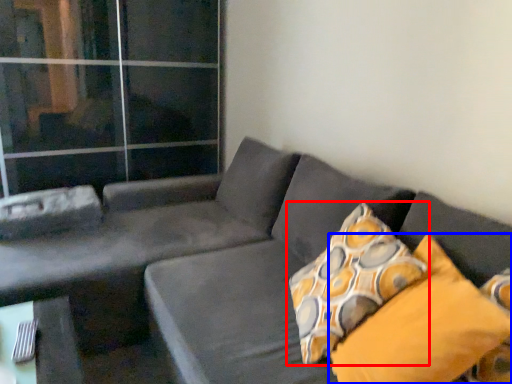
Question: Which of the following is the farthest to the observer, pillow (highlighted by a red box) or pillow (highlighted by a blue box)?

Choices:
 (A) pillow
 (B) pillow

Answer: (A)